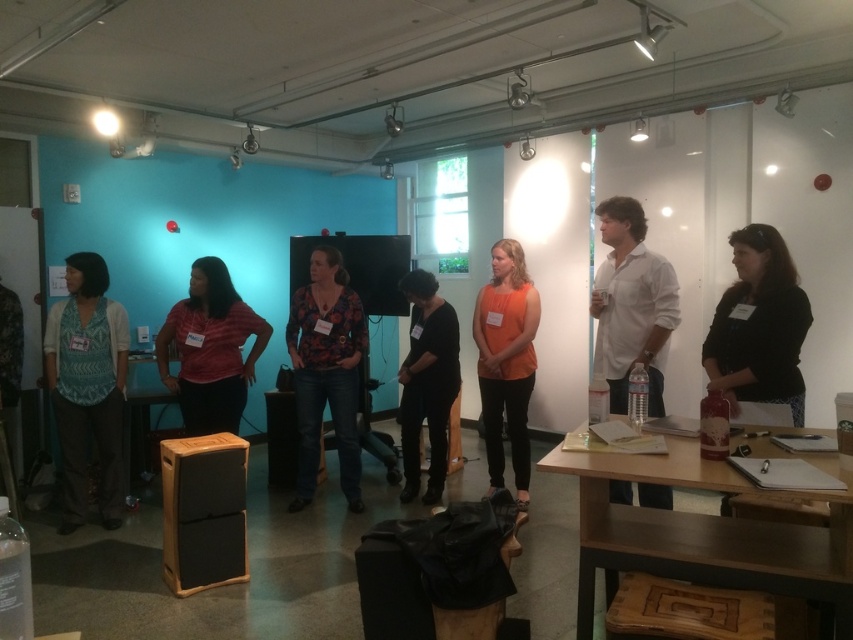
Does orange matte tank top at center come in front of black matte dress at center?

Yes, orange matte tank top at center is in front of black matte dress at center.

Can you confirm if orange matte tank top at center is positioned above black matte dress at center?

Yes, orange matte tank top at center is above black matte dress at center.

Between point (514, 298) and point (431, 493), which one is positioned behind?

Positioned behind is point (431, 493).

Locate an element on the screen. The width and height of the screenshot is (853, 640). orange matte tank top at center is located at coordinates (506, 362).

Which is more to the left, wooden table at lower right or black matte dress at center?

From the viewer's perspective, black matte dress at center appears more on the left side.

Locate an element on the screen. The image size is (853, 640). wooden table at lower right is located at coordinates (706, 531).

I want to click on wooden table at lower right, so click(706, 531).

Does wooden table at lower right appear on the left side of matte red shirt at center?

No, wooden table at lower right is not to the left of matte red shirt at center.

Does point (593, 593) come behind point (199, 420)?

No, it is in front of (199, 420).

You are a GUI agent. You are given a task and a screenshot of the screen. Output one action in this format:
    pyautogui.click(x=<x>, y=<y>)
    Task: Click on the wooden table at lower right
    The height and width of the screenshot is (640, 853).
    Given the screenshot: What is the action you would take?
    pyautogui.click(x=706, y=531)